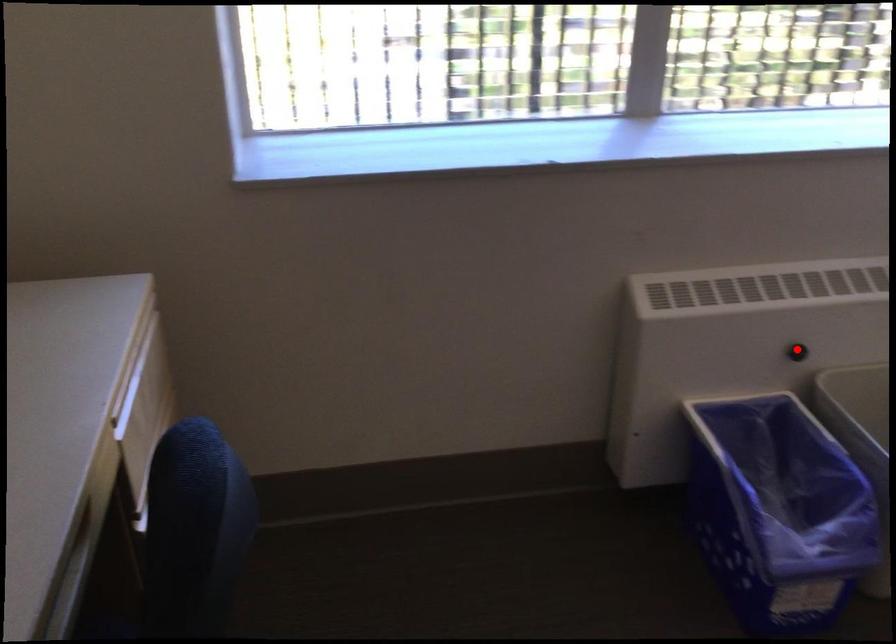
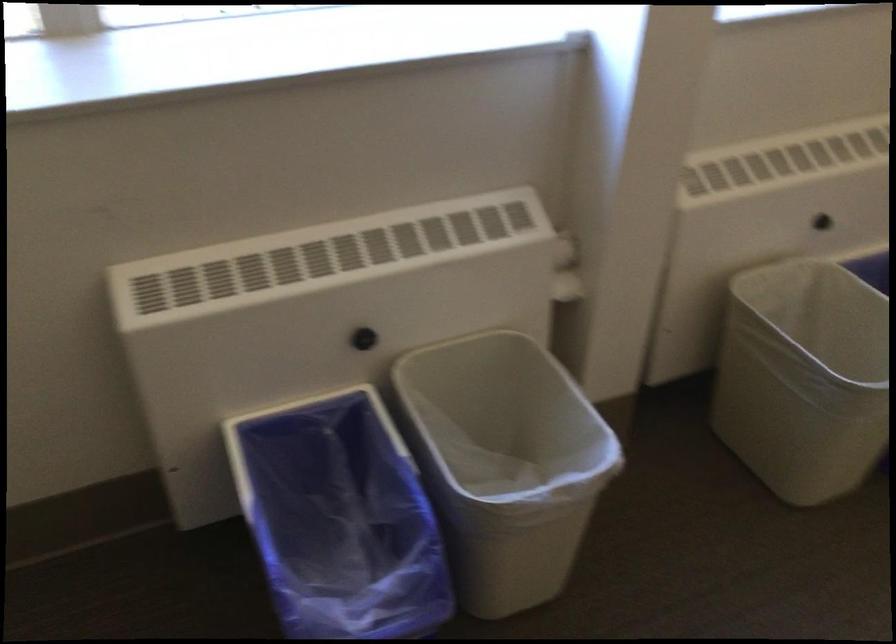
Question: A red point is marked in image1. In image2, is the corresponding 3D point closer to the camera or farther? Reply with the corresponding letter.

Choices:
 (A) The corresponding 3D point is closer.
 (B) The corresponding 3D point is farther.

Answer: (A)